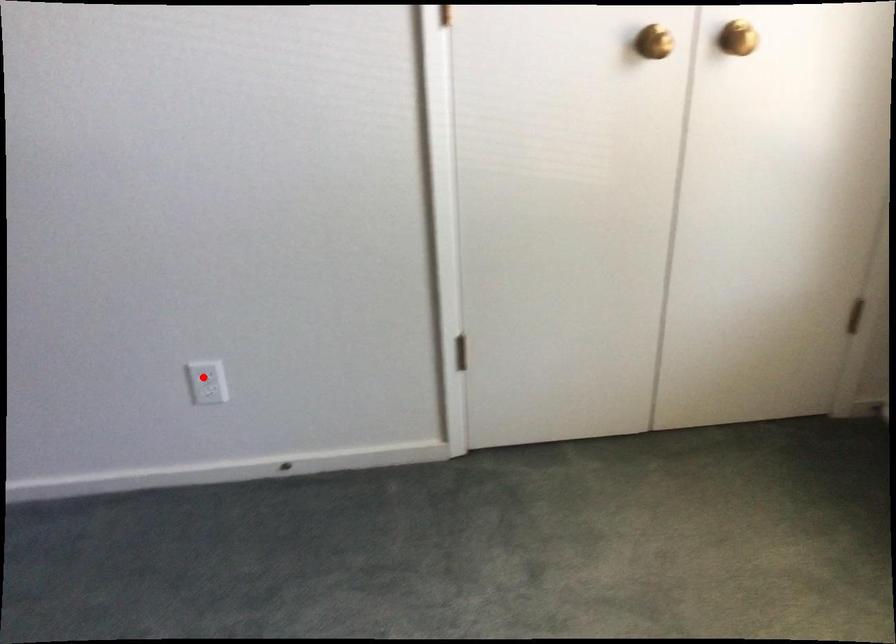
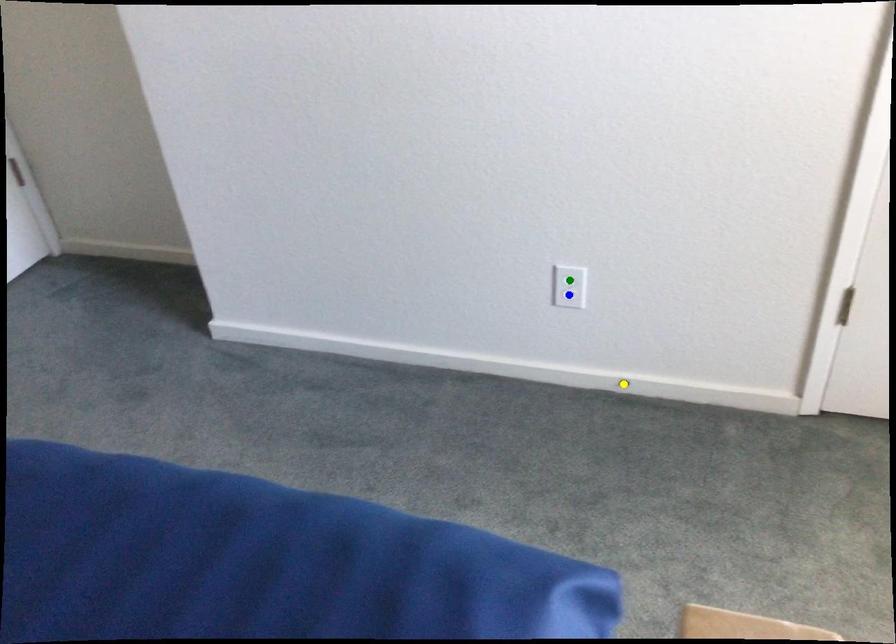
Question: I am providing you with two images of the same scene from different viewpoints. A red point is marked on the first image. You are given multiple points on the second image. Can you choose the point in image 2 that corresponds to the point in image 1?

Choices:
 (A) blue point
 (B) yellow point
 (C) green point

Answer: (C)